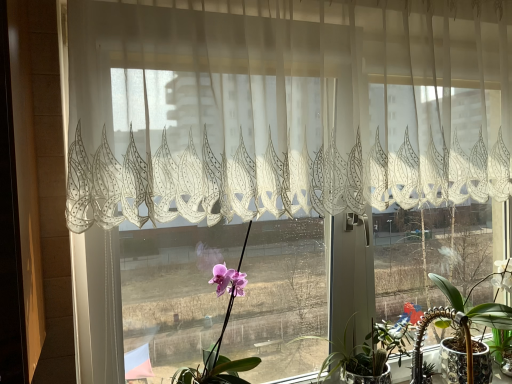
Question: Can you confirm if translucent white lace curtain at upper center is taller than green glossy succulent at lower right, the second houseplant positioned from the right?

Choices:
 (A) yes
 (B) no

Answer: (A)

Question: Considering the relative sizes of translucent white lace curtain at upper center and green glossy succulent at lower right, which ranks as the 2th houseplant in left-to-right order, in the image provided, is translucent white lace curtain at upper center shorter than green glossy succulent at lower right, which ranks as the 2th houseplant in left-to-right order,?

Choices:
 (A) no
 (B) yes

Answer: (A)

Question: Is translucent white lace curtain at upper center oriented away from green glossy succulent at lower right, the second houseplant positioned from the right?

Choices:
 (A) yes
 (B) no

Answer: (B)

Question: From a real-world perspective, does translucent white lace curtain at upper center sit lower than green glossy succulent at lower right, the second houseplant positioned from the right?

Choices:
 (A) no
 (B) yes

Answer: (A)

Question: From the image's perspective, is translucent white lace curtain at upper center on top of green glossy succulent at lower right, the second houseplant positioned from the right?

Choices:
 (A) no
 (B) yes

Answer: (B)

Question: Does point (188, 382) appear closer or farther from the camera than point (343, 349)?

Choices:
 (A) farther
 (B) closer

Answer: (B)

Question: From the image's perspective, is pink matte orchid at center, which is the 3th houseplant in right-to-left order, positioned above or below green glossy succulent at lower right, the second houseplant positioned from the right?

Choices:
 (A) above
 (B) below

Answer: (A)

Question: In terms of size, does pink matte orchid at center, which ranks as the 1th houseplant in left-to-right order, appear bigger or smaller than green glossy succulent at lower right, the second houseplant positioned from the right?

Choices:
 (A) small
 (B) big

Answer: (B)

Question: Do you think pink matte orchid at center, which ranks as the 1th houseplant in left-to-right order, is within green glossy succulent at lower right, which ranks as the 2th houseplant in left-to-right order, or outside of it?

Choices:
 (A) inside
 (B) outside

Answer: (B)

Question: Is point (223, 327) closer or farther from the camera than point (239, 54)?

Choices:
 (A) closer
 (B) farther

Answer: (B)

Question: In terms of height, does pink matte orchid at center, which is the 3th houseplant in right-to-left order, look taller or shorter compared to translucent white lace curtain at upper center?

Choices:
 (A) tall
 (B) short

Answer: (B)

Question: From the image's perspective, relative to translucent white lace curtain at upper center, is pink matte orchid at center, which ranks as the 1th houseplant in left-to-right order, above or below?

Choices:
 (A) above
 (B) below

Answer: (B)

Question: Is pink matte orchid at center, which ranks as the 1th houseplant in left-to-right order, wider or thinner than translucent white lace curtain at upper center?

Choices:
 (A) thin
 (B) wide

Answer: (B)

Question: From the image's perspective, is green glossy succulent at lower right, the second houseplant positioned from the right, above or below white glossy pot at lower right, marked as the third houseplant in a left-to-right arrangement?

Choices:
 (A) below
 (B) above

Answer: (A)

Question: Considering the positions of green glossy succulent at lower right, which ranks as the 2th houseplant in left-to-right order, and white glossy pot at lower right, the 1th houseplant in the right-to-left sequence, in the image, is green glossy succulent at lower right, which ranks as the 2th houseplant in left-to-right order, bigger or smaller than white glossy pot at lower right, the 1th houseplant in the right-to-left sequence,?

Choices:
 (A) big
 (B) small

Answer: (B)